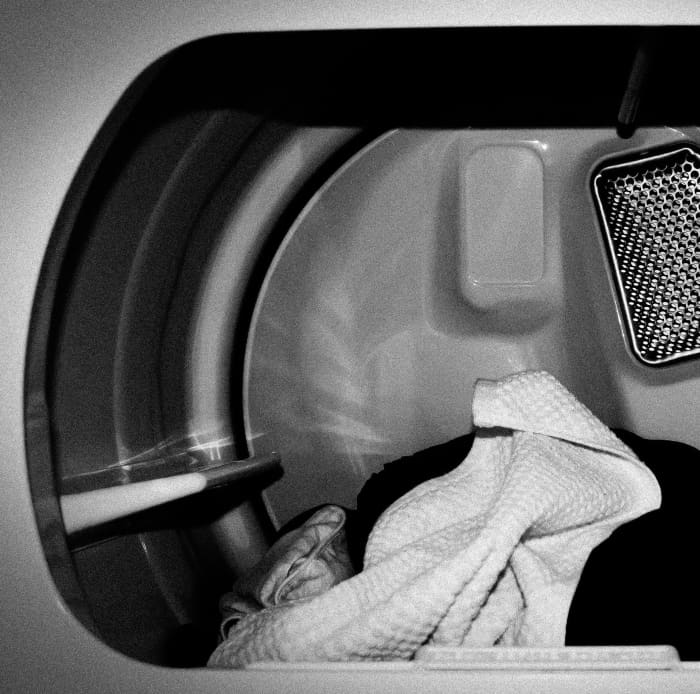
Identify the location of the top of drum of dryer. (489, 103).